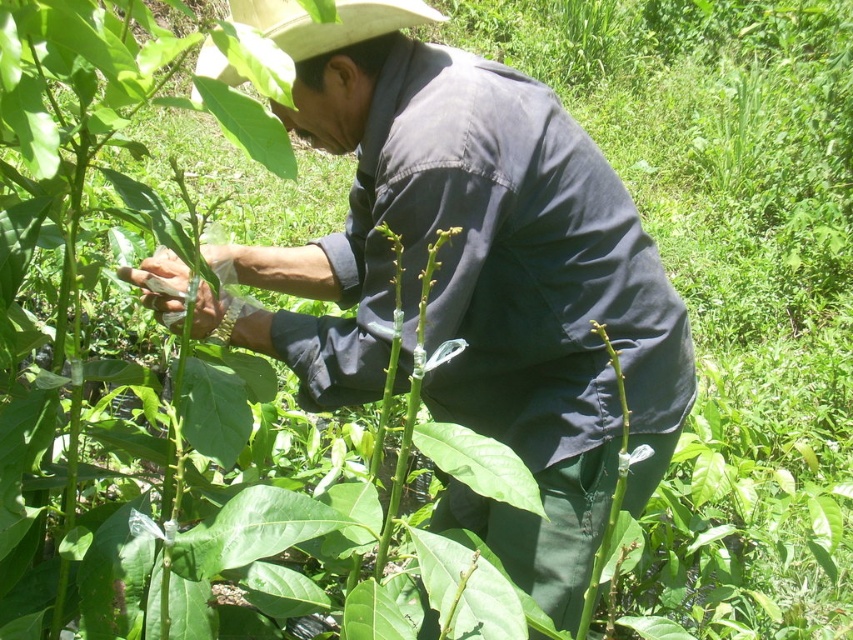
You are a photographer trying to capture the person in the scene. You notice the dark blue shirt at center and the white straw cowboy hat at upper center. Which object should you focus on first if you want to ensure both are in frame without moving the camera?

The dark blue shirt at center is taller than the white straw cowboy hat at upper center, so you should focus on the dark blue shirt at center first to ensure both are in frame without moving the camera.

A photographer wants to capture the scene while ensuring both the dark blue shirt at center and the white straw cowboy hat at upper center are clearly visible. Given that the camera can focus on objects within a 15 inch range, will both items be in focus?

The dark blue shirt at center and the white straw cowboy hat at upper center are 17.06 inches apart from each other. Since the camera can only focus within a 15 inch range, the distance between them exceeds this limit, so both items cannot be in focus simultaneously.